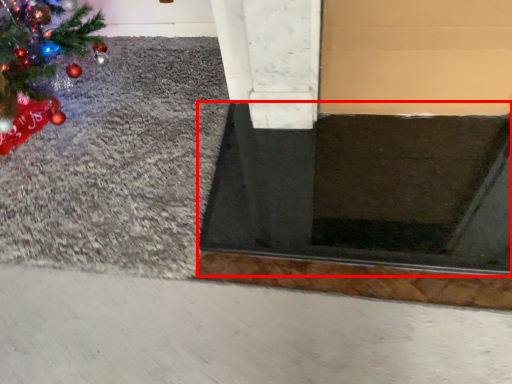
Question: From the image's perspective, where is doormat (annotated by the red box) located in relation to gravel in the image?

Choices:
 (A) below
 (B) above

Answer: (A)